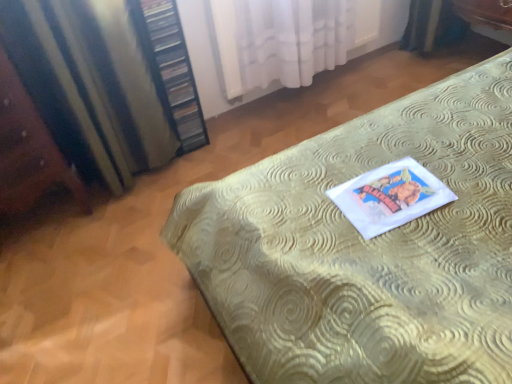
Locate an element on the screen. free spot below satin striped curtain at left, positioned as the second curtain in right-to-left order (from a real-world perspective) is located at coordinates (139, 185).